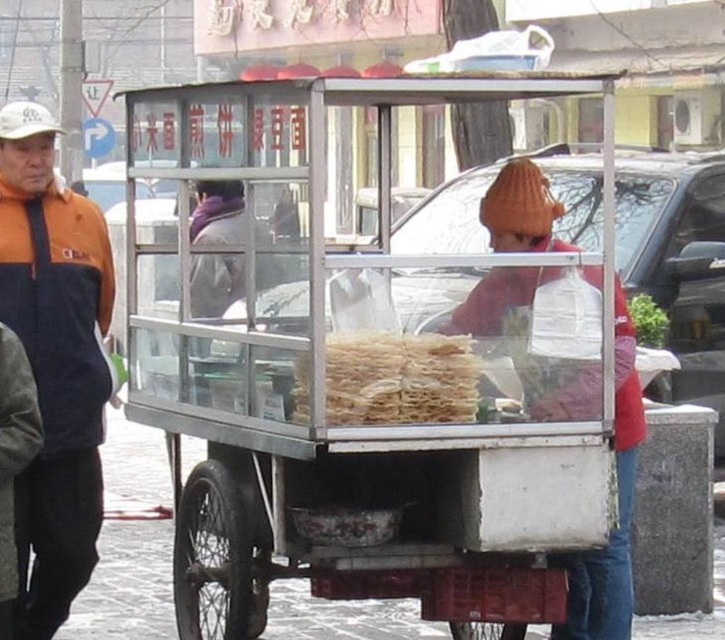
Question: Which point is closer to the camera taking this photo?

Choices:
 (A) (167, 301)
 (B) (392, 368)
 (C) (529, 236)
 (D) (78, 509)

Answer: (B)

Question: Does orange fleece jacket at left lie in front of orange knit hat at center?

Choices:
 (A) no
 (B) yes

Answer: (A)

Question: Is orange fleece jacket at left above translucent plastic noodles at center?

Choices:
 (A) no
 (B) yes

Answer: (B)

Question: Which object is the farthest from the orange fleece jacket at left?

Choices:
 (A) translucent plastic noodles at center
 (B) metallic silver cart at center
 (C) orange knit hat at center

Answer: (C)

Question: Can you confirm if metallic silver cart at center is positioned to the right of translucent plastic noodles at center?

Choices:
 (A) no
 (B) yes

Answer: (A)

Question: Considering the real-world distances, which object is closest to the metallic silver cart at center?

Choices:
 (A) orange fleece jacket at left
 (B) translucent plastic noodles at center
 (C) orange knit hat at center

Answer: (B)